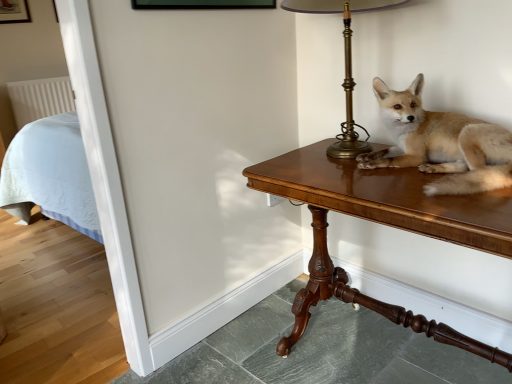
Measure the distance between point (x=336, y=145) and camera.

They are 1.50 meters apart.

What do you see at coordinates (345, 64) in the screenshot?
I see `brass lampshade at upper right` at bounding box center [345, 64].

Find the location of a particular element. wooden table at right is located at coordinates (384, 223).

Find the location of `brass lampshade at upper right`. brass lampshade at upper right is located at coordinates (345, 64).

Which is closer, (351,144) or (436,220)?

The point (436,220) is closer.

Is brass lampshade at upper right turned away from wooden table at right?

No, brass lampshade at upper right is not facing away from wooden table at right.

From the picture: Considering the sizes of objects brass lampshade at upper right and wooden table at right in the image provided, who is thinner, brass lampshade at upper right or wooden table at right?

brass lampshade at upper right.

In the scene shown: From the image's perspective, is brass lampshade at upper right on top of wooden table at right?

Yes, from the image's perspective, brass lampshade at upper right is above wooden table at right.

Does light brown fur at center have a lesser height compared to brass lampshade at upper right?

Indeed, light brown fur at center has a lesser height compared to brass lampshade at upper right.

Looking at the image, does light brown fur at center seem bigger or smaller compared to brass lampshade at upper right?

light brown fur at center is smaller than brass lampshade at upper right.

Looking at this image, can brass lampshade at upper right be found inside light brown fur at center?

That's incorrect, brass lampshade at upper right is not inside light brown fur at center.

What's the angular difference between light brown fur at center and brass lampshade at upper right's facing directions?

The facing directions of light brown fur at center and brass lampshade at upper right are 5.88 degrees apart.

From a real-world perspective, is brass lampshade at upper right above or below light brown fur at center?

In terms of real-world spatial position, brass lampshade at upper right is above light brown fur at center.

Identify the location of dog in front of the brass lampshade at upper right. (440, 144).

From their relative heights in the image, would you say brass lampshade at upper right is taller or shorter than light brown fur at center?

brass lampshade at upper right is taller than light brown fur at center.

Is brass lampshade at upper right further to the viewer compared to light brown fur at center?

Yes, brass lampshade at upper right is further from the viewer.

Is light brown fur at center wider or thinner than wooden table at right?

In the image, light brown fur at center appears to be more narrow than wooden table at right.

Can you confirm if light brown fur at center is smaller than wooden table at right?

Yes.

Is point (496, 188) closer or farther from the camera than point (407, 202)?

Point (496, 188).

Would you say light brown fur at center is a long distance from wooden table at right?

No, light brown fur at center is in close proximity to wooden table at right.

Which point is more forward, (326, 263) or (331, 152)?

Positioned in front is point (331, 152).

Is wooden table at right turned away from brass lampshade at upper right?

No.

How many degrees apart are the facing directions of wooden table at right and brass lampshade at upper right?

There is a 0.476-degree angle between the facing directions of wooden table at right and brass lampshade at upper right.

Looking at their sizes, would you say wooden table at right is wider or thinner than brass lampshade at upper right?

In the image, wooden table at right appears to be wider than brass lampshade at upper right.

Who is shorter, wooden table at right or light brown fur at center?

light brown fur at center.

Is wooden table at right closer to the viewer compared to light brown fur at center?

Yes, it is.

Considering the relative sizes of wooden table at right and light brown fur at center in the image provided, is wooden table at right wider than light brown fur at center?

Indeed, wooden table at right has a greater width compared to light brown fur at center.

Considering the positions of point (405, 323) and point (505, 182), is point (405, 323) closer or farther from the camera than point (505, 182)?

Point (405, 323).

Find the location of a particular element. The width and height of the screenshot is (512, 384). table located underneath the brass lampshade at upper right (from a real-world perspective) is located at coordinates (384, 223).

This screenshot has height=384, width=512. In order to click on dog that is below the brass lampshade at upper right (from the image's perspective) in this screenshot , I will do `click(440, 144)`.

Looking at the image, which one is located closer to wooden table at right, light brown fur at center or brass lampshade at upper right?

light brown fur at center lies closer to wooden table at right than the other object.

Based on their spatial positions, is brass lampshade at upper right or wooden table at right further from light brown fur at center?

brass lampshade at upper right is further to light brown fur at center.

Based on the photo, which object lies nearer to the anchor point brass lampshade at upper right, wooden table at right or light brown fur at center?

light brown fur at center is closer to brass lampshade at upper right.

Consider the image. Which object lies further to the anchor point light brown fur at center, wooden table at right or brass lampshade at upper right?

The object further to light brown fur at center is brass lampshade at upper right.

Considering their positions, is brass lampshade at upper right positioned closer to wooden table at right than light brown fur at center?

The object closer to wooden table at right is light brown fur at center.

From the image, which object appears to be nearer to brass lampshade at upper right, light brown fur at center or wooden table at right?

light brown fur at center.

Where is `dog between brass lampshade at upper right and wooden table at right from top to bottom`? Image resolution: width=512 pixels, height=384 pixels. dog between brass lampshade at upper right and wooden table at right from top to bottom is located at coordinates (440, 144).